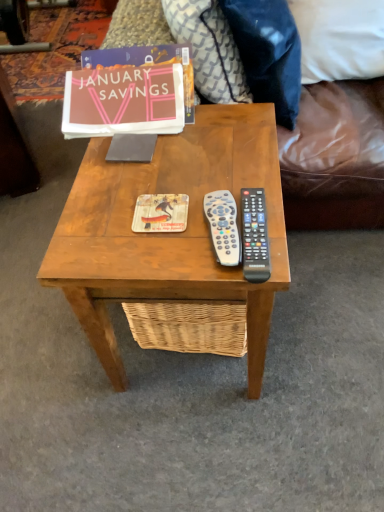
This screenshot has height=512, width=384. I want to click on vacant area that is situated to the right of matte paper book cover at center, so click(x=238, y=185).